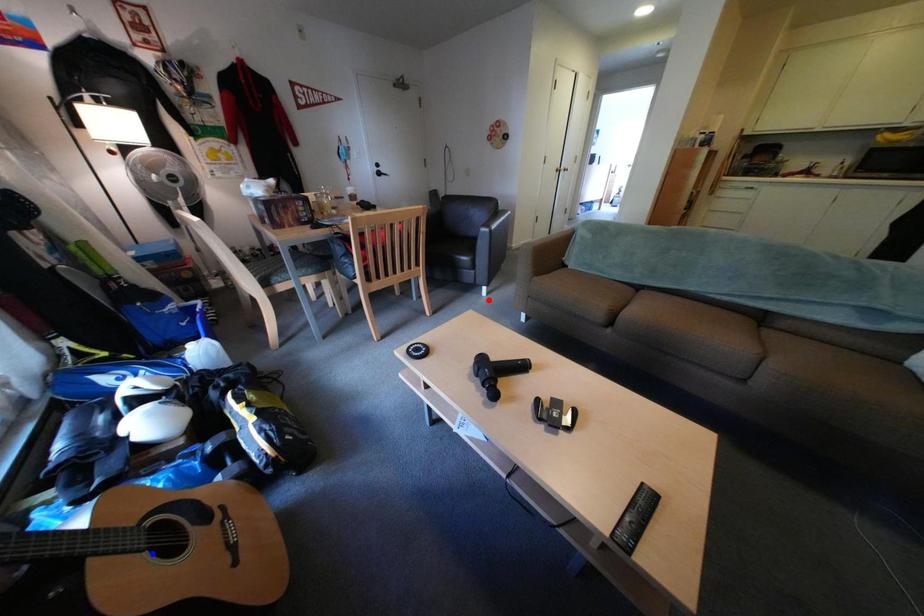
Question: Two points are marked on the image. Which point is closer to the camera?

Choices:
 (A) Blue point is closer.
 (B) Red point is closer.

Answer: (A)